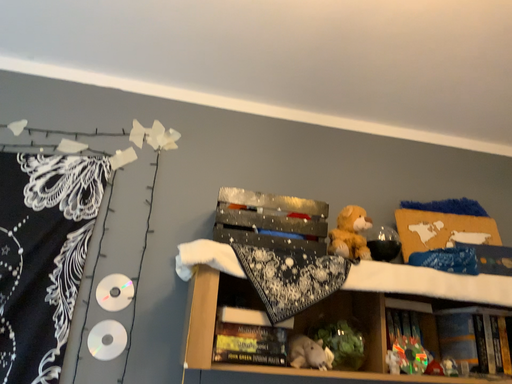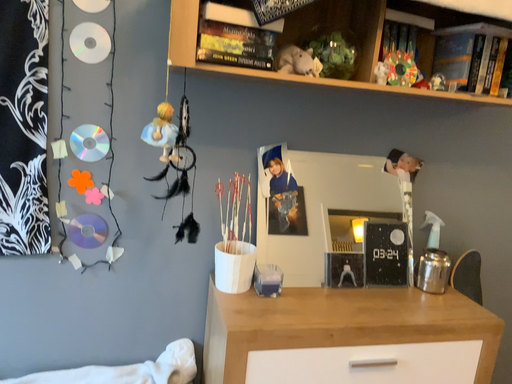
Question: Which way did the camera rotate in the video?

Choices:
 (A) rotated downward
 (B) rotated upward

Answer: (A)